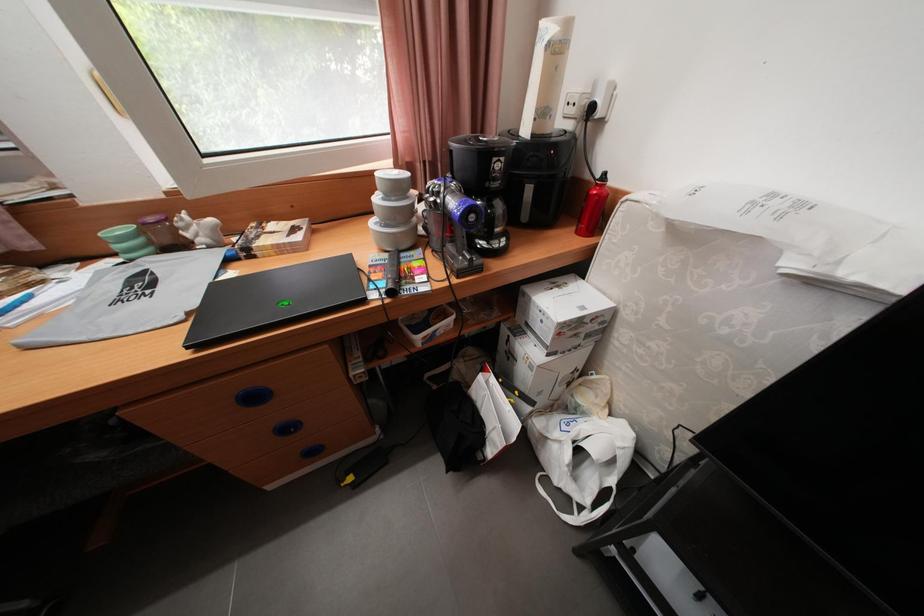
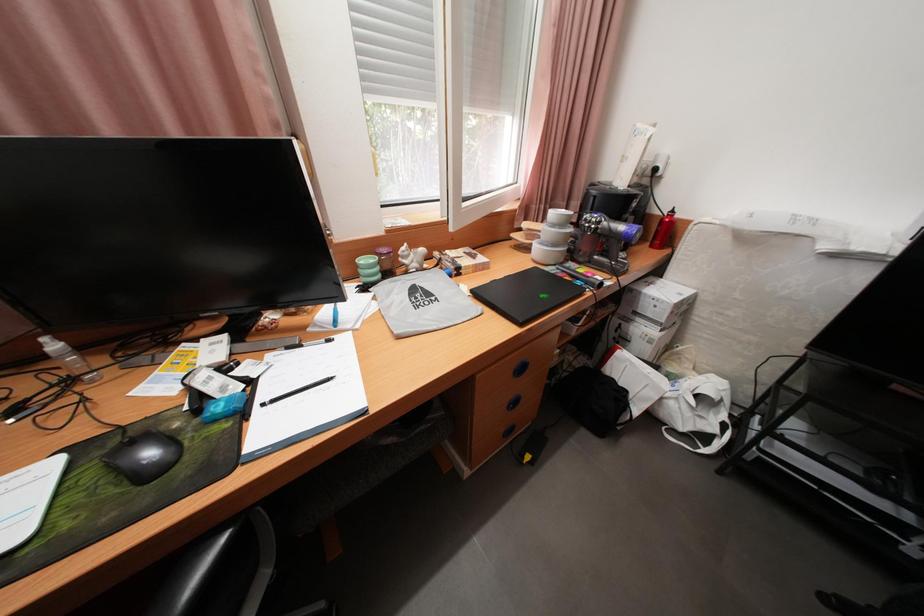
Question: In a continuous first-person perspective shot, in which direction is the camera moving?

Choices:
 (A) Left
 (B) Right
 (C) Forward
 (D) Backward

Answer: (A)